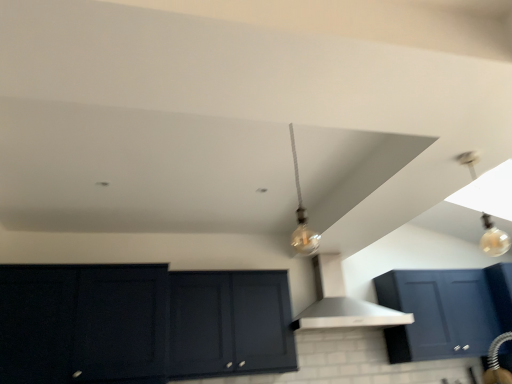
Question: Is translucent glass bulb at upper right wider or thinner than white matte vent at center?

Choices:
 (A) thin
 (B) wide

Answer: (A)

Question: Considering the positions of translucent glass bulb at upper right and white matte vent at center in the image, is translucent glass bulb at upper right taller or shorter than white matte vent at center?

Choices:
 (A) short
 (B) tall

Answer: (A)

Question: Estimate the real-world distances between objects in this image. Which object is farther from the white matte vent at center?

Choices:
 (A) translucent glass bulb at upper right
 (B) matte black cabinet at center, the 1th cabinetry when ordered from right to left
 (C) matte dark blue cabinet at lower left, placed as the 2th cabinetry when sorted from right to left

Answer: (A)

Question: Which object is positioned farthest from the translucent glass bulb at upper right?

Choices:
 (A) matte dark blue cabinet at lower left, placed as the 2th cabinetry when sorted from right to left
 (B) white matte vent at center
 (C) matte black cabinet at center, the 1th cabinetry when ordered from right to left

Answer: (A)